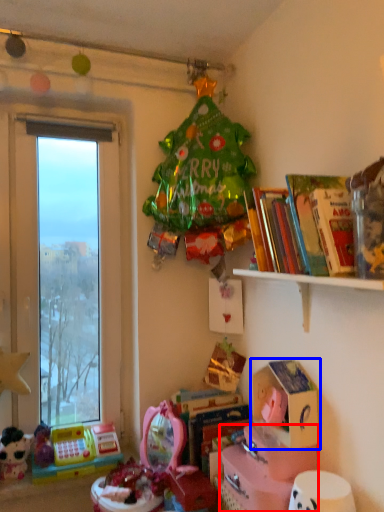
Question: Which object is closer to the camera taking this photo, cardboard box (highlighted by a red box) or cardboard box (highlighted by a blue box)?

Choices:
 (A) cardboard box
 (B) cardboard box

Answer: (A)